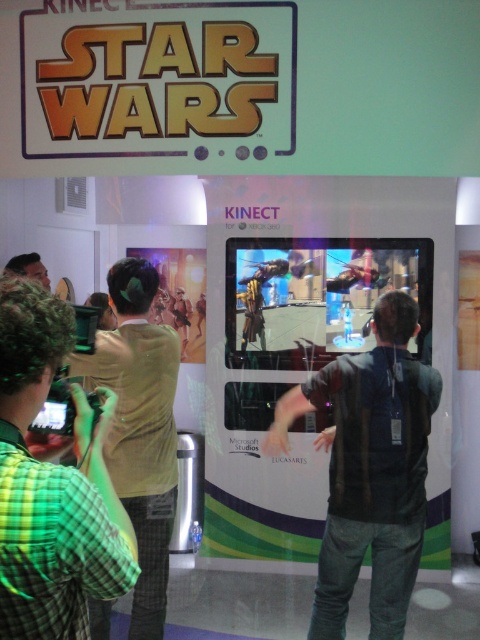
You are at a Star Wars gaming event and see two attendees wearing shirts. One is wearing a green plaid shirt at left and another is wearing a light brown shirt at center. From the perspective of someone facing the screen, which shirt is positioned more to the right?

The green plaid shirt at left is positioned more to the right than the light brown shirt at center.

You are a game developer analyzing the promotional image for a Star Wars Kinect experience. You notice two clothing items on the central screen display. Which clothing item is positioned lower on the screen between the dark gray vest at center and the light brown shirt at center?

The dark gray vest at center is located below the light brown shirt at center, so it is positioned lower on the screen.

You are a game developer designing a promotional poster for the Star Wars Kinect game. You need to ensure that the dark gray vest at center and the light brown shirt at center are both visible. Which object should you scale down to make sure both fit well on the poster?

The dark gray vest at center is larger in size than the light brown shirt at center. To ensure both fit well on the poster, you should scale down the dark gray vest at center since it is the larger of the two.